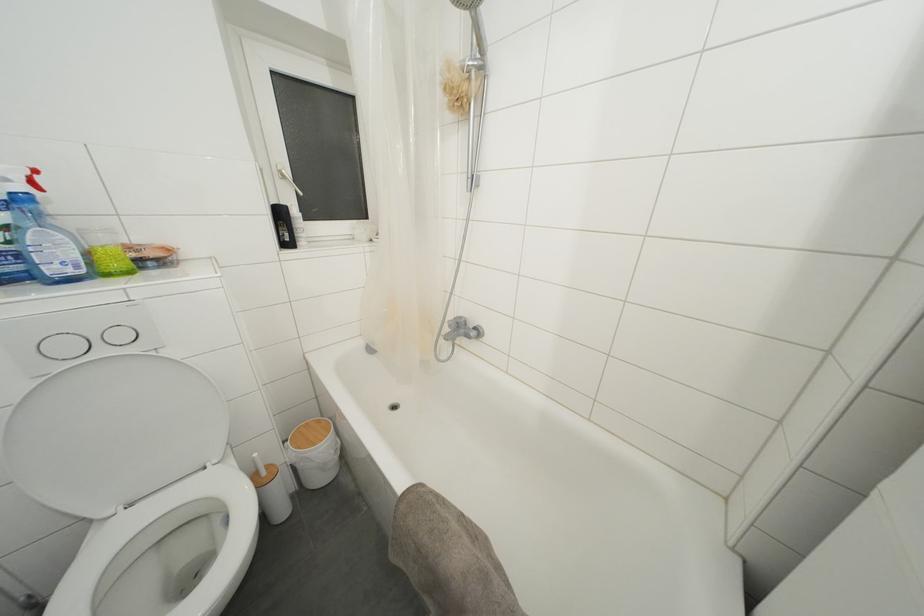
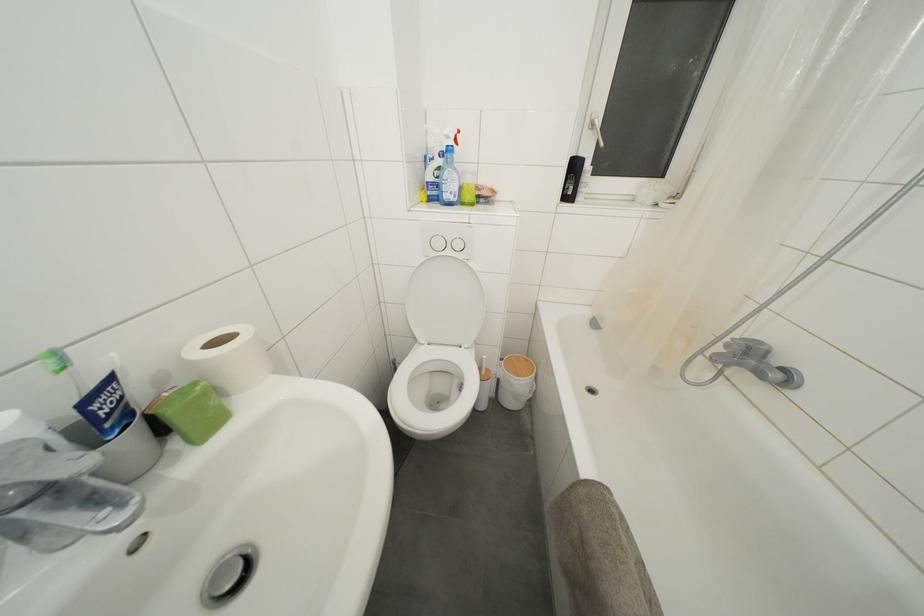
Where in the second image is the point corresponding to (x=310, y=429) from the first image?

(521, 362)